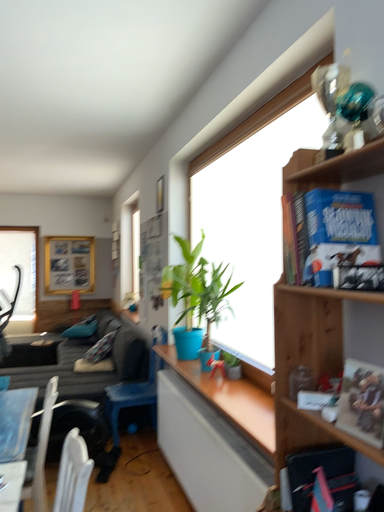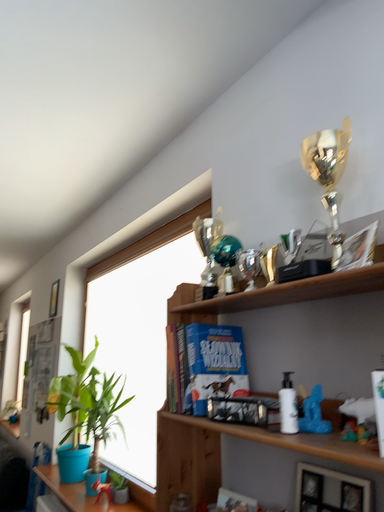
Question: Which way did the camera rotate in the video?

Choices:
 (A) rotated downward
 (B) rotated upward

Answer: (B)